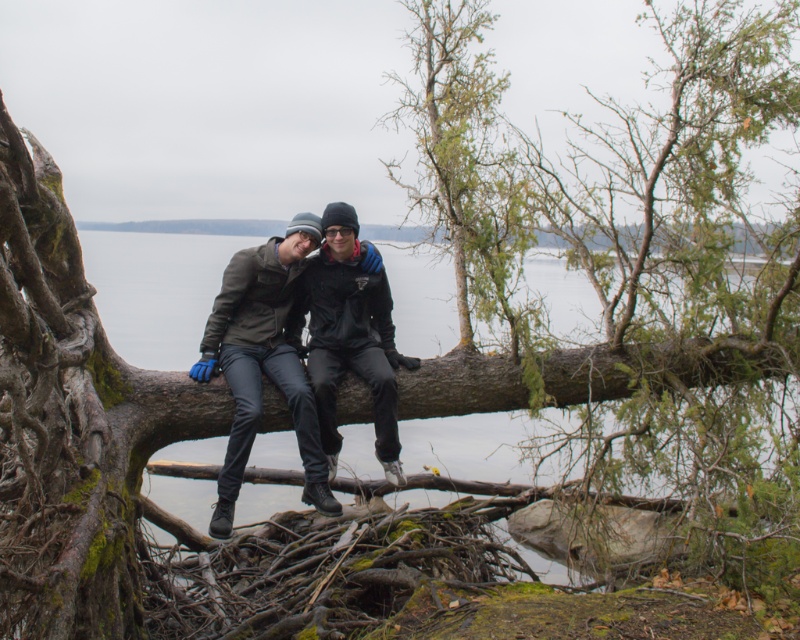
Question: Does dark gray leather jacket at center have a smaller size compared to black matte jacket at center?

Choices:
 (A) no
 (B) yes

Answer: (A)

Question: Which of these objects is positioned farthest from the black matte jacket at center?

Choices:
 (A) dark gray leather jacket at center
 (B) green rough bark tree at center

Answer: (B)

Question: Considering the relative positions of green rough bark tree at center and black matte jacket at center in the image provided, where is green rough bark tree at center located with respect to black matte jacket at center?

Choices:
 (A) below
 (B) above

Answer: (B)

Question: Which object appears farthest from the camera in this image?

Choices:
 (A) green rough bark tree at center
 (B) black matte jacket at center
 (C) dark gray leather jacket at center

Answer: (B)

Question: Which is farther from the green rough bark tree at center?

Choices:
 (A) black matte jacket at center
 (B) dark gray leather jacket at center

Answer: (B)

Question: Is green rough bark tree at center below dark gray leather jacket at center?

Choices:
 (A) no
 (B) yes

Answer: (A)